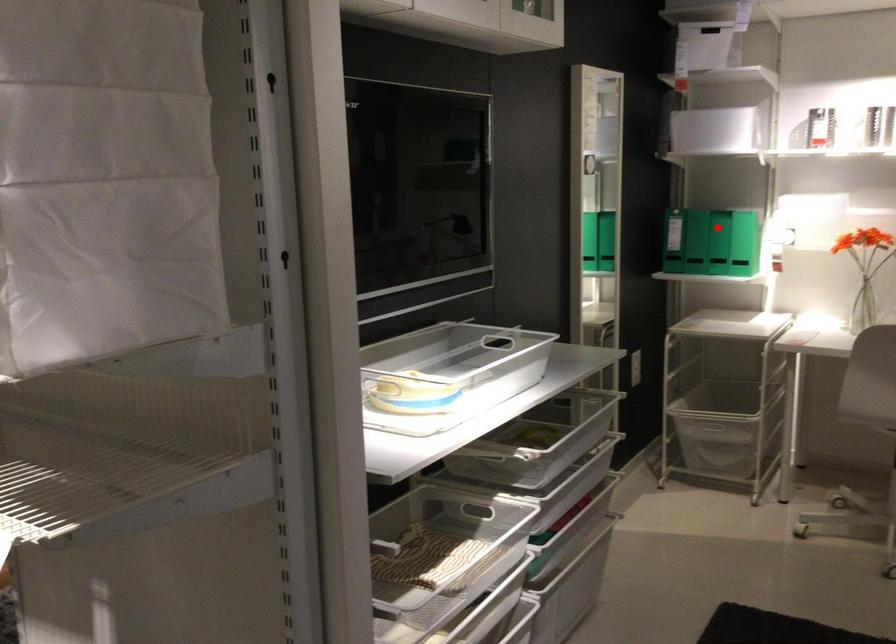
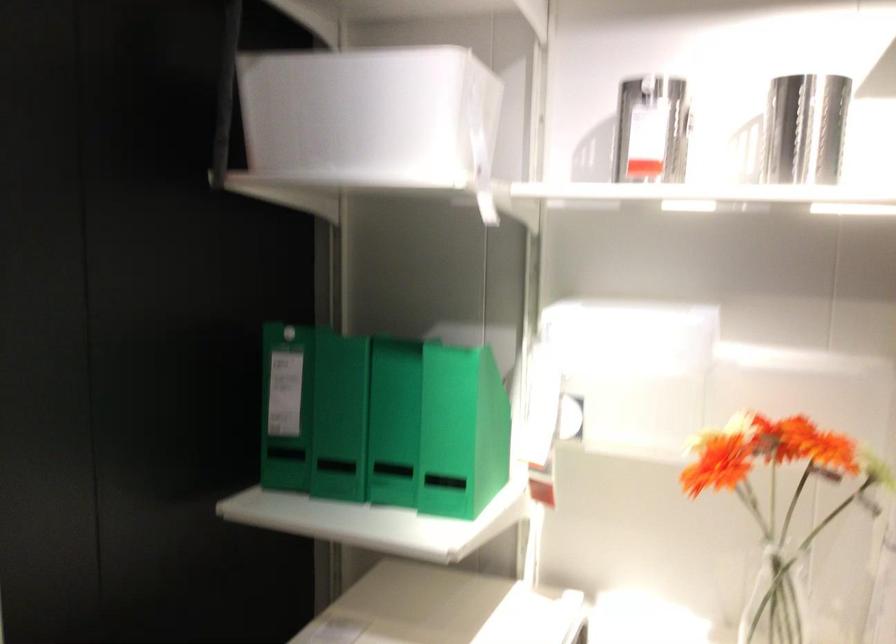
The point at the highlighted location is marked in the first image. Where is the corresponding point in the second image?

(339, 417)